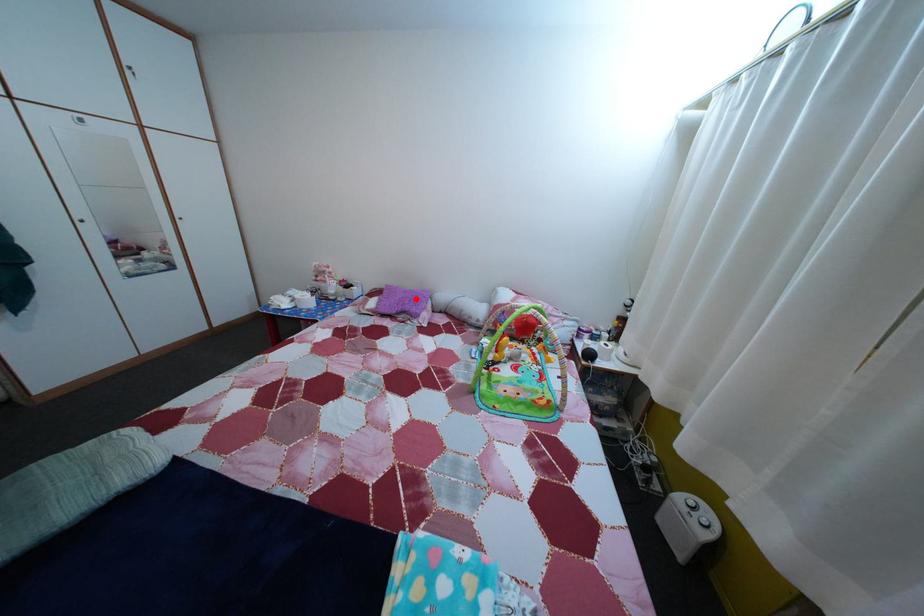
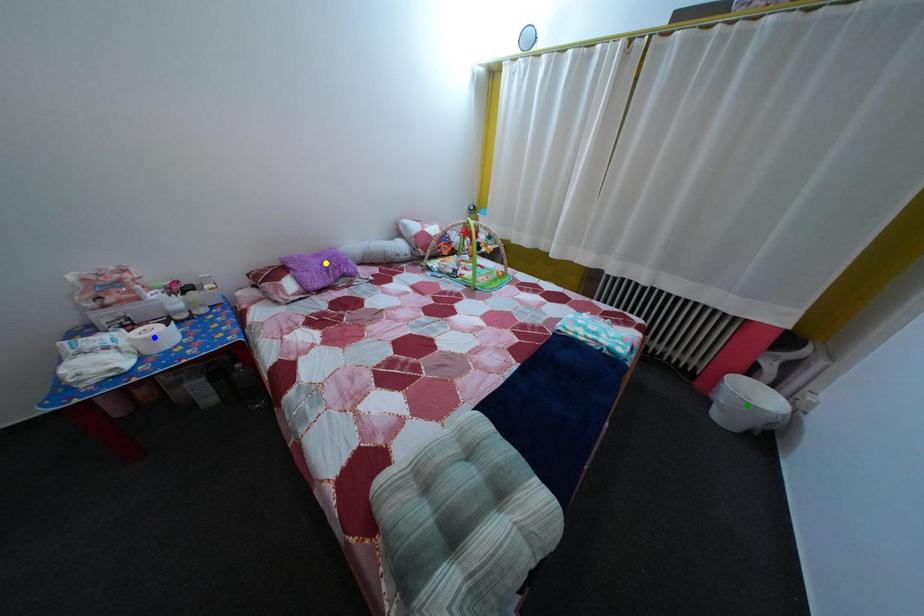
Question: I am providing you with two images of the same scene from different viewpoints. A red point is marked on the first image. You are given multiple points on the second image. Can you choose the point in image 2 that corresponds to the point in image 1?

Choices:
 (A) blue point
 (B) green point
 (C) yellow point

Answer: (C)